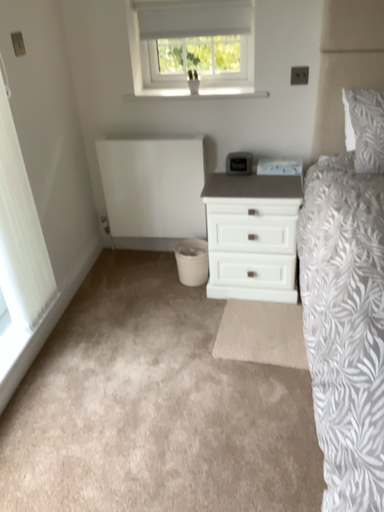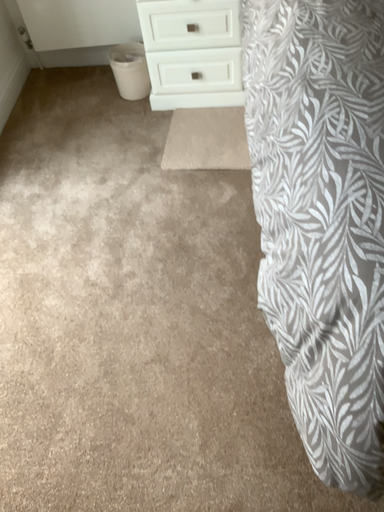
Question: How did the camera likely rotate when shooting the video?

Choices:
 (A) rotated downward
 (B) rotated upward

Answer: (A)